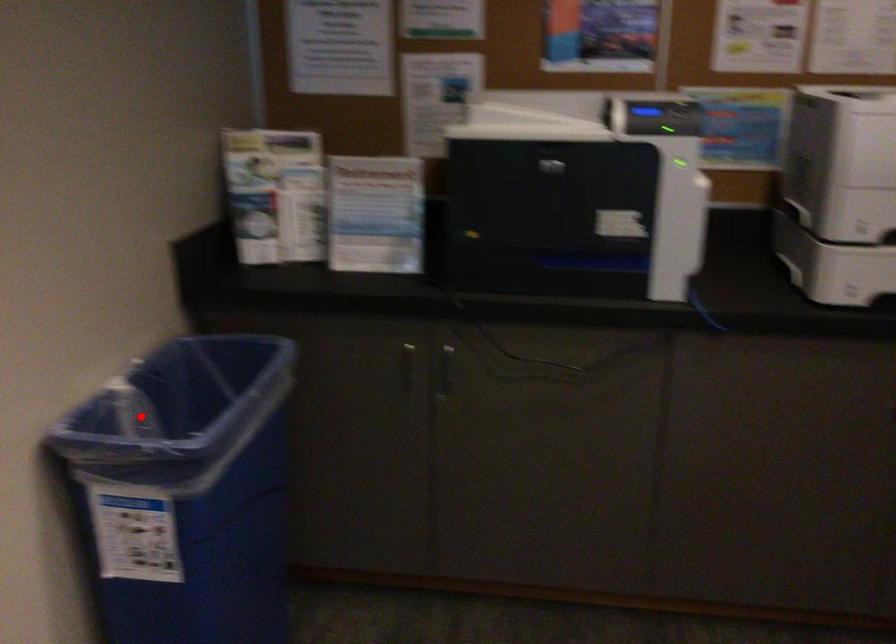
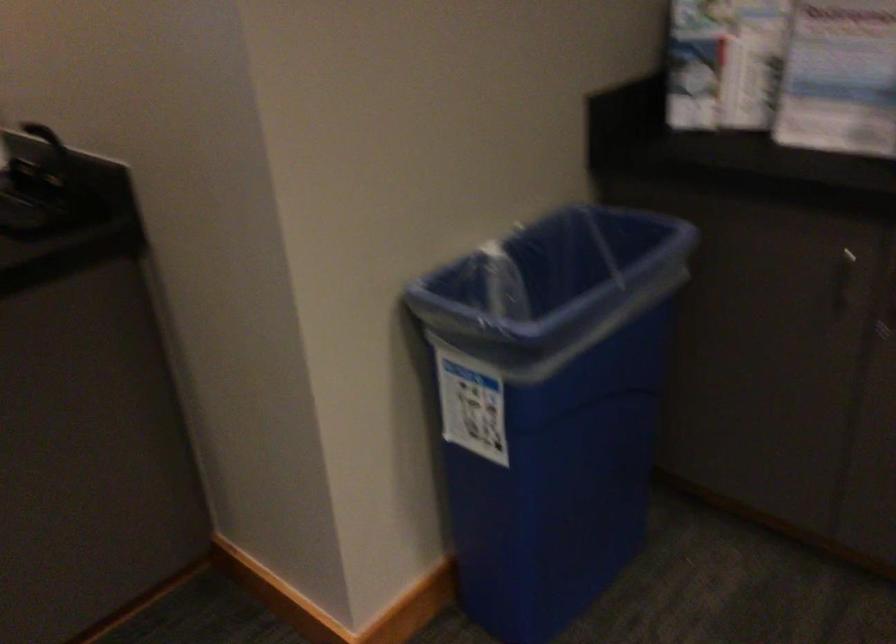
Where in the second image is the point corresponding to the highlighted location from the first image?

(504, 283)